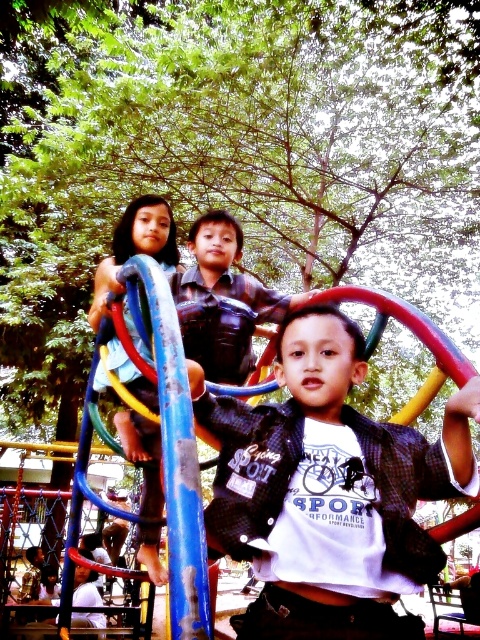
Question: Which point is farther to the camera?

Choices:
 (A) matte blue pole at center
 (B) matte black shirt at center

Answer: (A)

Question: Does matte black shirt at center appear under light blue fabric at left?

Choices:
 (A) yes
 (B) no

Answer: (A)

Question: In this image, where is matte blue pole at center located relative to light blue fabric at left?

Choices:
 (A) below
 (B) above

Answer: (B)

Question: Does matte black shirt at center appear under light blue fabric at left?

Choices:
 (A) no
 (B) yes

Answer: (B)

Question: Among these objects, which one is farthest from the camera?

Choices:
 (A) matte blue pole at center
 (B) matte black shirt at center
 (C) light blue fabric at left

Answer: (A)

Question: Which point is closer to the camera?

Choices:
 (A) light blue fabric at left
 (B) matte black shirt at center
 (C) matte blue pole at center

Answer: (B)